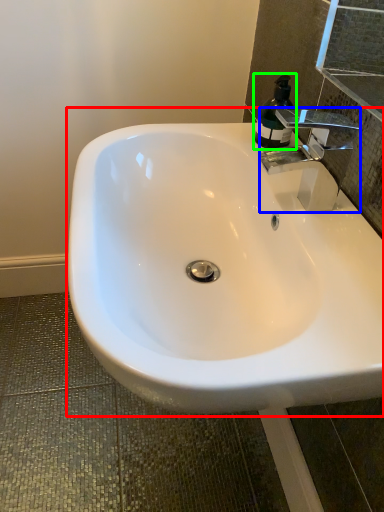
Question: Which object is positioned farthest from sink (highlighted by a red box)? Select from tap (highlighted by a blue box) and soap dispenser (highlighted by a green box).

Choices:
 (A) tap
 (B) soap dispenser

Answer: (B)